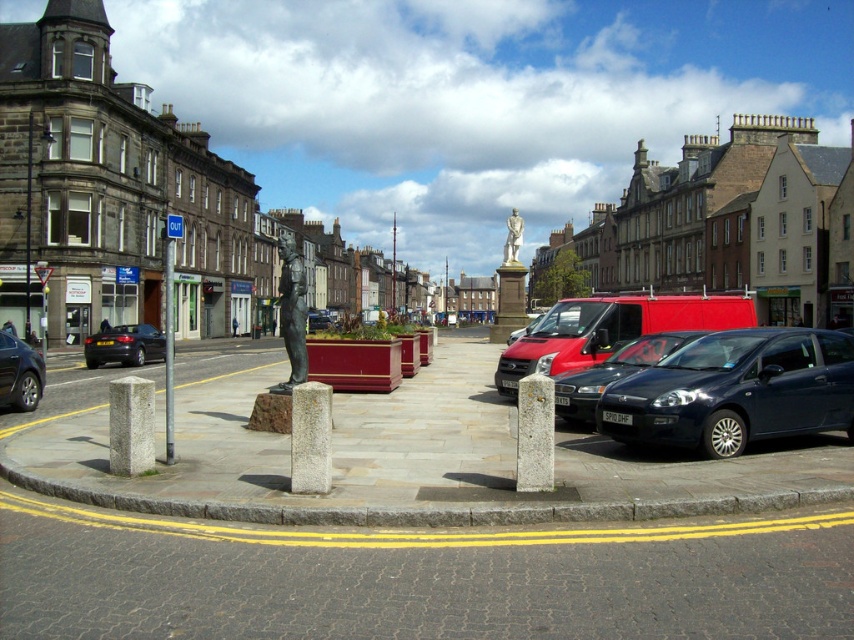
Question: Is the position of gray stone pillar at lower left more distant than that of brick stone statue at center?

Choices:
 (A) no
 (B) yes

Answer: (A)

Question: Which point is farther to the camera?

Choices:
 (A) (509, 218)
 (B) (120, 419)
 (C) (34, 353)

Answer: (A)

Question: Which point is closer to the camera taking this photo?

Choices:
 (A) (295, 364)
 (B) (24, 372)
 (C) (167, 273)

Answer: (A)

Question: Estimate the real-world distances between objects in this image. Which object is closer to the gray stone pillar at lower left?

Choices:
 (A) dark blue metallic hatchback at lower right
 (B) shiny black sedan at lower left
 (C) white marble statue at center

Answer: (B)

Question: In this image, where is matte black car at lower right located relative to brushed metal pole at left?

Choices:
 (A) above
 (B) below

Answer: (B)

Question: Is brushed metal pole at left positioned before white marble statue at center?

Choices:
 (A) no
 (B) yes

Answer: (B)